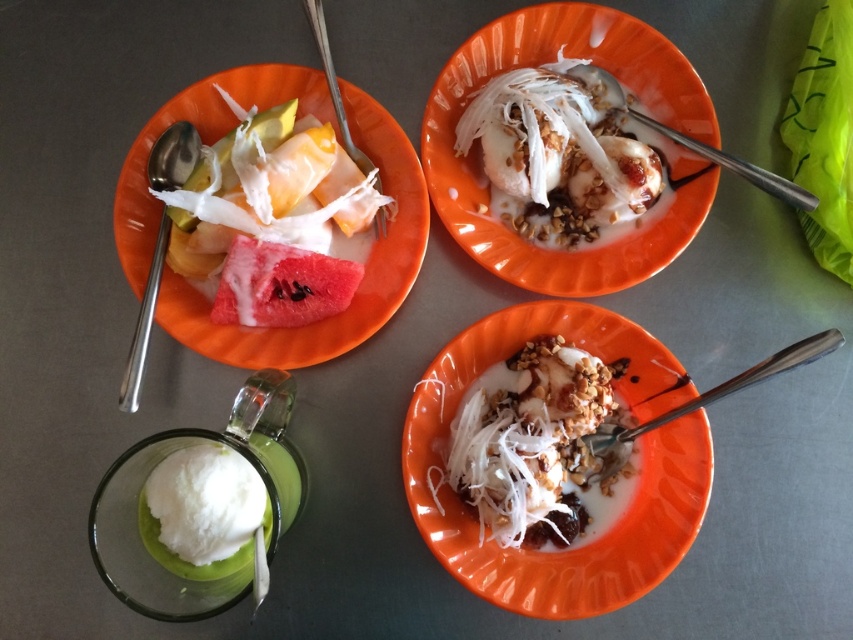
You are at the center of the table and want to place a new dessert plate between the orange matte bowl at center and the plate on the left. Is there enough space to place it there?

The orange matte bowl at center is located at point (634, 476), so placing a new dessert plate between it and the plate on the left would require knowing the distance between them. However, the exact spatial relationship isn not provided in the objects description. Therefore, it is unclear if there is sufficient space to place the new plate between them.

You are a dessert lover who wants to know which item is larger between the orange matte bowl at center and the white creamy ice cream at center. Can you tell me which one is bigger?

The orange matte bowl at center is bigger than the white creamy ice cream at center according to the description provided.